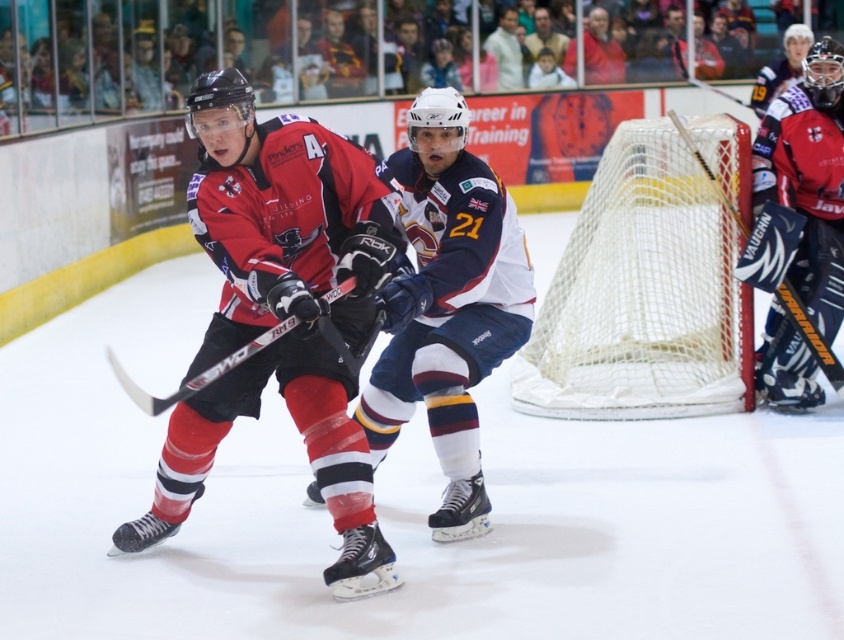
Question: Among these objects, which one is farthest from the camera?

Choices:
 (A) matte black jersey at center
 (B) white jersey at center
 (C) black matte hockey stick at center
 (D) red matte goalie at right

Answer: (D)

Question: Does matte black jersey at center have a lesser width compared to matte black hockey stick at right?

Choices:
 (A) yes
 (B) no

Answer: (B)

Question: Which point is farther to the camera?

Choices:
 (A) red matte goalie at right
 (B) matte black jersey at center
 (C) matte black hockey stick at right
 (D) white jersey at center

Answer: (A)

Question: Which point is farther to the camera?

Choices:
 (A) (131, 390)
 (B) (825, 323)

Answer: (B)

Question: Does white jersey at center have a lesser width compared to black matte hockey stick at center?

Choices:
 (A) yes
 (B) no

Answer: (A)

Question: In this image, where is matte black jersey at center located relative to red matte goalie at right?

Choices:
 (A) above
 (B) below

Answer: (B)